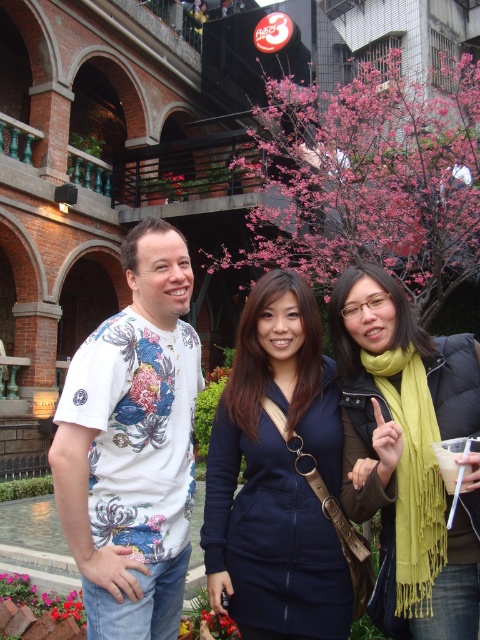
Does white floral t-shirt at left appear under white paper cup at lower right?

Actually, white floral t-shirt at left is above white paper cup at lower right.

Who is higher up, white floral t-shirt at left or white paper cup at lower right?

white floral t-shirt at left is higher up.

Is point (107, 483) positioned before point (453, 460)?

No.

Identify the location of white floral t-shirt at left. This screenshot has height=640, width=480. (132, 445).

Which is in front, point (160, 515) or point (356, 355)?

Point (160, 515) is in front.

From the picture: Which of these two, white floral t-shirt at left or green scarf at center, stands taller?

white floral t-shirt at left

You are a GUI agent. You are given a task and a screenshot of the screen. Output one action in this format:
    pyautogui.click(x=<x>, y=<y>)
    Task: Click on the white floral t-shirt at left
    
    Given the screenshot: What is the action you would take?
    pyautogui.click(x=132, y=445)

Is point (419, 438) positioned behind point (60, 509)?

Yes, it is.

Image resolution: width=480 pixels, height=640 pixels. What do you see at coordinates (409, 445) in the screenshot?
I see `green scarf at center` at bounding box center [409, 445].

The image size is (480, 640). What do you see at coordinates (409, 445) in the screenshot? I see `green scarf at center` at bounding box center [409, 445].

Find the location of a particular element. This screenshot has width=480, height=640. green scarf at center is located at coordinates (409, 445).